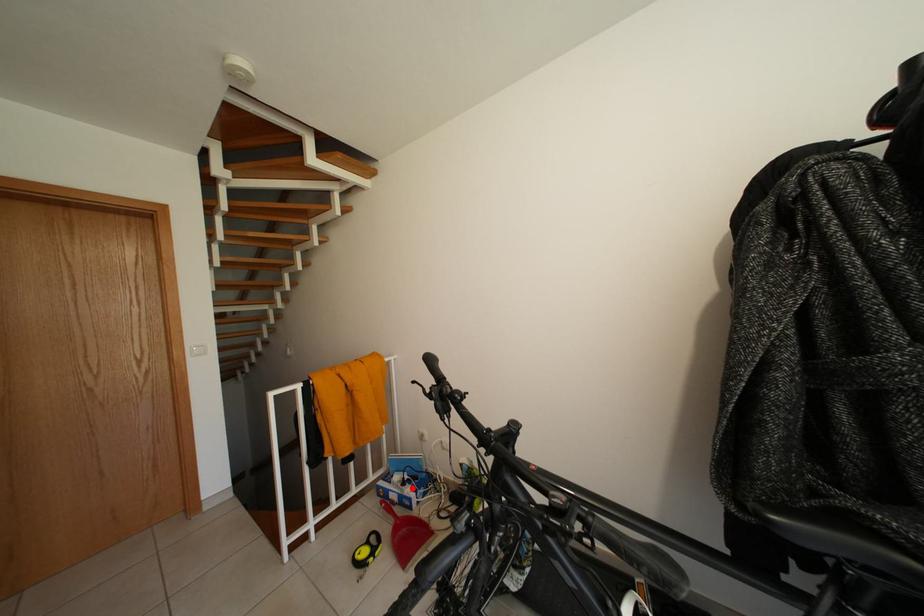
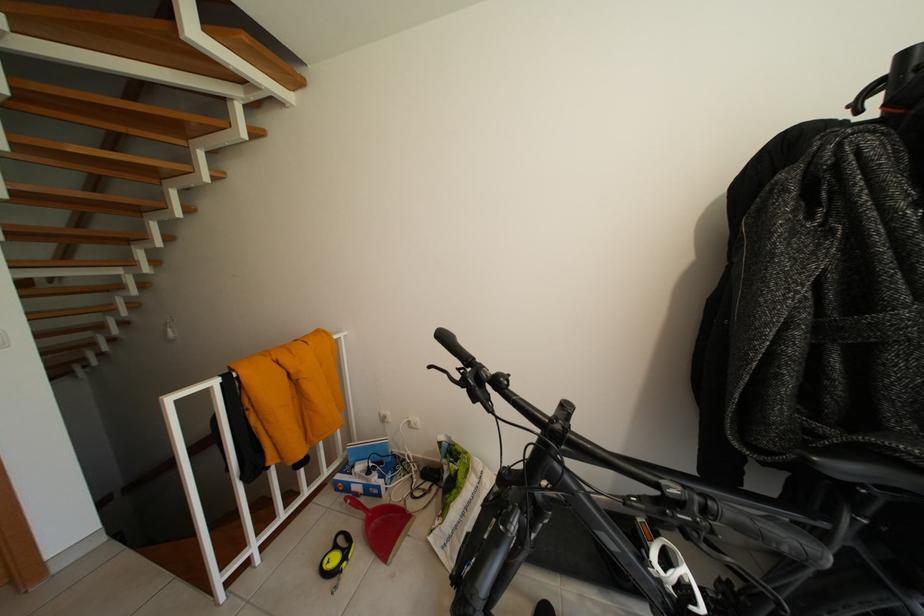
Locate, in the second image, the point that corresponds to the highlighted location in the first image.

(378, 477)